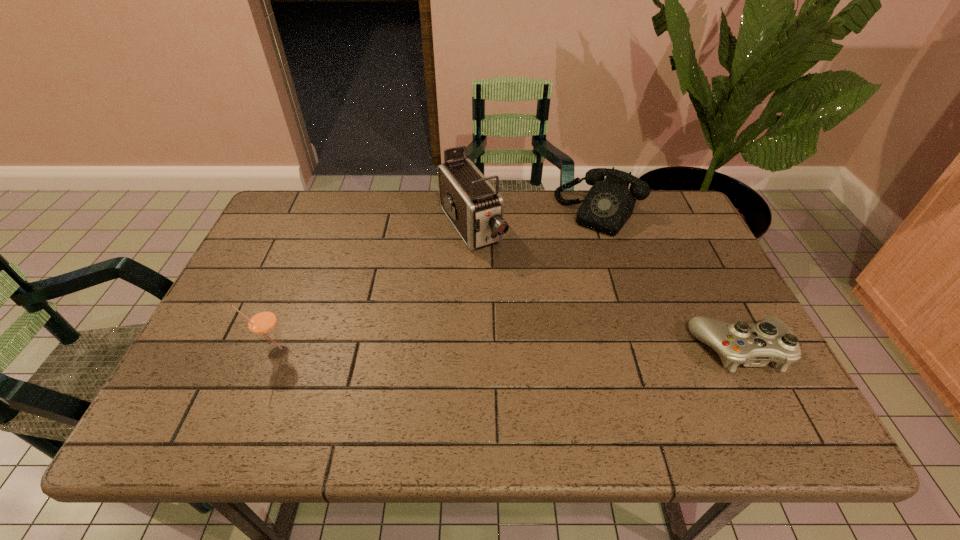
Select which object appears as the second closest to the telephone. Please provide its 2D coordinates. Your answer should be formatted as a tuple, i.e. [(x, y)], where the tuple contains the x and y coordinates of a point satisfying the conditions above.

[(754, 345)]

Where is `object that can be found as the closest to the third tallest object`? object that can be found as the closest to the third tallest object is located at coordinates (x=475, y=208).

Where is `free point that satisfies the following two spatial constraints: 1. on the back side of the second shortest object; 2. on the right side of the second object from left to right`? This screenshot has width=960, height=540. free point that satisfies the following two spatial constraints: 1. on the back side of the second shortest object; 2. on the right side of the second object from left to right is located at coordinates (472, 213).

Identify the location of free space that satisfies the following two spatial constraints: 1. on the back side of the tallest object; 2. on the right side of the telephone. (472, 213).

Identify the location of free spot that satisfies the following two spatial constraints: 1. on the back side of the leftmost object; 2. on the right side of the control. The width and height of the screenshot is (960, 540). (277, 350).